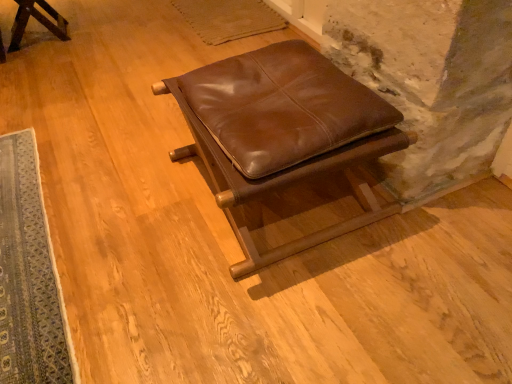
This screenshot has width=512, height=384. In order to click on vacant area that lies to the right of matte brown leather stool at upper left, the first furniture when ordered from top to bottom in this screenshot , I will do `click(102, 37)`.